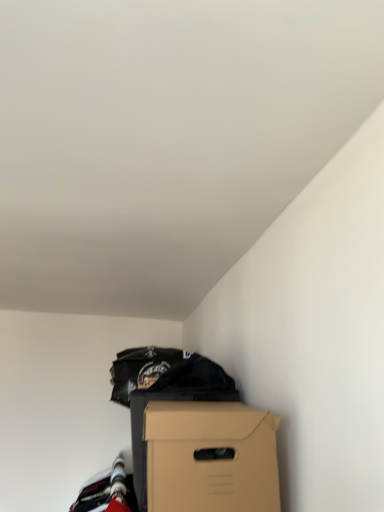
This screenshot has width=384, height=512. What are the coordinates of `brown cardboard box at lower right` in the screenshot? It's located at [210, 457].

Consider the image. In order to face brown cardboard box at lower right, should I rotate leftwards or rightwards?

To align with it, rotate right about 1.318°.

The height and width of the screenshot is (512, 384). What do you see at coordinates (210, 457) in the screenshot?
I see `brown cardboard box at lower right` at bounding box center [210, 457].

Where is `brown cardboard box at lower right`? brown cardboard box at lower right is located at coordinates 210,457.